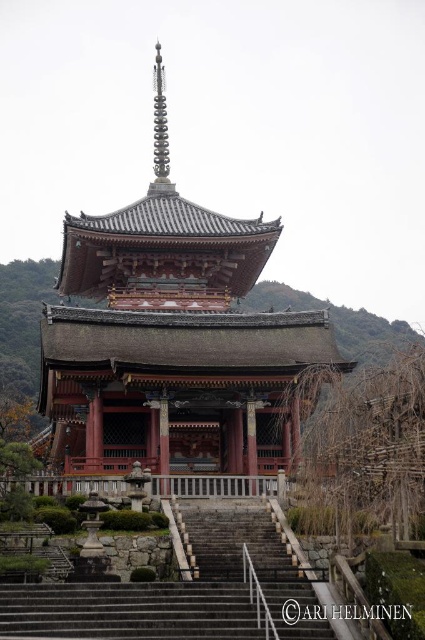
Does shiny red pagoda at center appear on the left side of gray stone stairs at lower center?

Correct, you'll find shiny red pagoda at center to the left of gray stone stairs at lower center.

Does point (170, 221) lie in front of point (130, 616)?

No, (170, 221) is behind (130, 616).

Locate an element on the screen. shiny red pagoda at center is located at coordinates (172, 339).

Who is higher up, shiny red pagoda at center or dark gray stone stairs at center?

Positioned higher is shiny red pagoda at center.

Does shiny red pagoda at center have a lesser width compared to dark gray stone stairs at center?

No, shiny red pagoda at center is not thinner than dark gray stone stairs at center.

Is point (193, 442) farther from viewer compared to point (119, 609)?

Yes, point (193, 442) is behind point (119, 609).

I want to click on shiny red pagoda at center, so click(172, 339).

Can you confirm if dark gray stone stairs at center is positioned to the right of gray stone stairs at lower center?

Indeed, dark gray stone stairs at center is positioned on the right side of gray stone stairs at lower center.

Does dark gray stone stairs at center appear on the left side of gray stone stairs at lower center?

Incorrect, dark gray stone stairs at center is not on the left side of gray stone stairs at lower center.

Who is more forward, (232, 564) or (201, 602)?

Positioned in front is point (201, 602).

Identify the location of dark gray stone stairs at center. This screenshot has width=425, height=640. (178, 593).